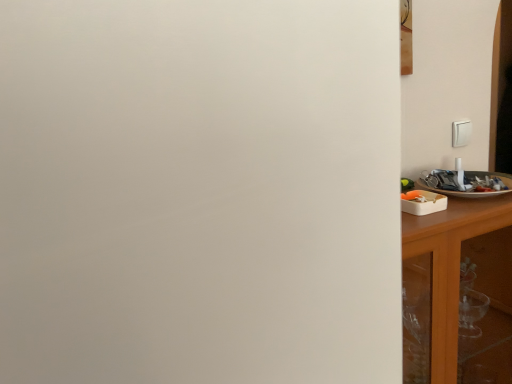
Question: From the image's perspective, is white glossy plate at right on top of wooden cabinet at right?

Choices:
 (A) yes
 (B) no

Answer: (A)

Question: Is white glossy plate at right aimed at wooden cabinet at right?

Choices:
 (A) yes
 (B) no

Answer: (B)

Question: Can wooden cabinet at right be found inside white glossy plate at right?

Choices:
 (A) no
 (B) yes

Answer: (A)

Question: Is white glossy plate at right at the left side of wooden cabinet at right?

Choices:
 (A) no
 (B) yes

Answer: (A)

Question: From a real-world perspective, is white glossy plate at right over wooden cabinet at right?

Choices:
 (A) yes
 (B) no

Answer: (A)

Question: Can you confirm if white glossy plate at right is taller than wooden cabinet at right?

Choices:
 (A) no
 (B) yes

Answer: (A)

Question: Can you confirm if wooden cabinet at right is wider than white glossy plate at right?

Choices:
 (A) yes
 (B) no

Answer: (A)

Question: From a real-world perspective, is wooden cabinet at right positioned under white glossy plate at right based on gravity?

Choices:
 (A) yes
 (B) no

Answer: (A)

Question: Would you say wooden cabinet at right contains white glossy plate at right?

Choices:
 (A) no
 (B) yes

Answer: (A)

Question: Considering the relative sizes of wooden cabinet at right and white glossy plate at right in the image provided, is wooden cabinet at right thinner than white glossy plate at right?

Choices:
 (A) yes
 (B) no

Answer: (B)

Question: Is wooden cabinet at right facing towards white glossy plate at right?

Choices:
 (A) yes
 (B) no

Answer: (B)

Question: Does wooden cabinet at right have a greater height compared to white glossy plate at right?

Choices:
 (A) no
 (B) yes

Answer: (B)

Question: Does point 420,243 appear closer or farther from the camera than point 416,185?

Choices:
 (A) closer
 (B) farther

Answer: (A)